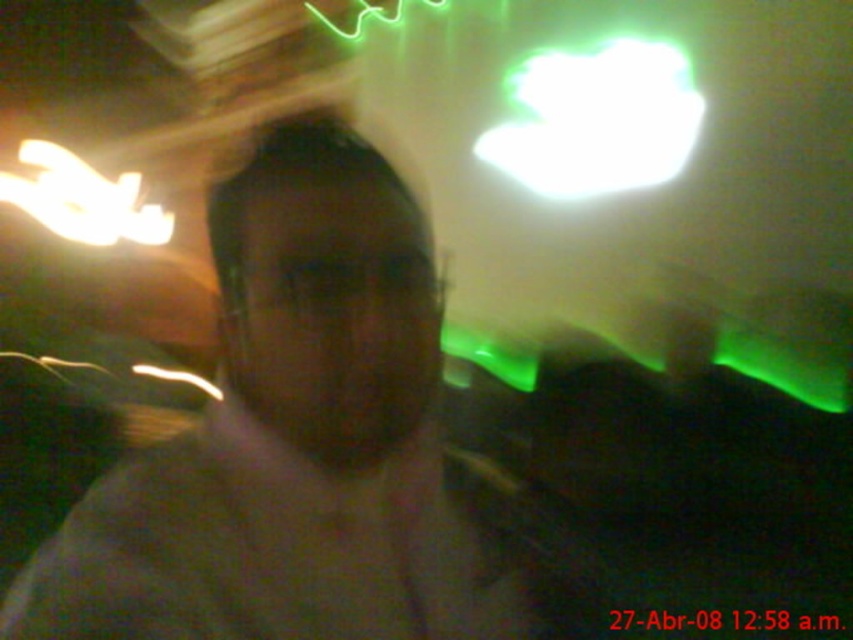
You are at a party and want to take a clearer photo of the person wearing the matte gray shirt at center and the dark gray cotton dress shirt at center. Which clothing item should you focus on first to ensure it appears sharp in the photo?

The matte gray shirt at center is positioned over the dark gray cotton dress shirt at center, so focusing on the matte gray shirt at center first will ensure it appears sharp in the photo.

Based on the photo, you are at a party and want to find the matte gray shirt at center. Which direction should you look relative to the dark gray cotton dress shirt at center?

The matte gray shirt at center is to the left of the dark gray cotton dress shirt at center, so you should look to the left of the dark gray cotton dress shirt at center to find it.